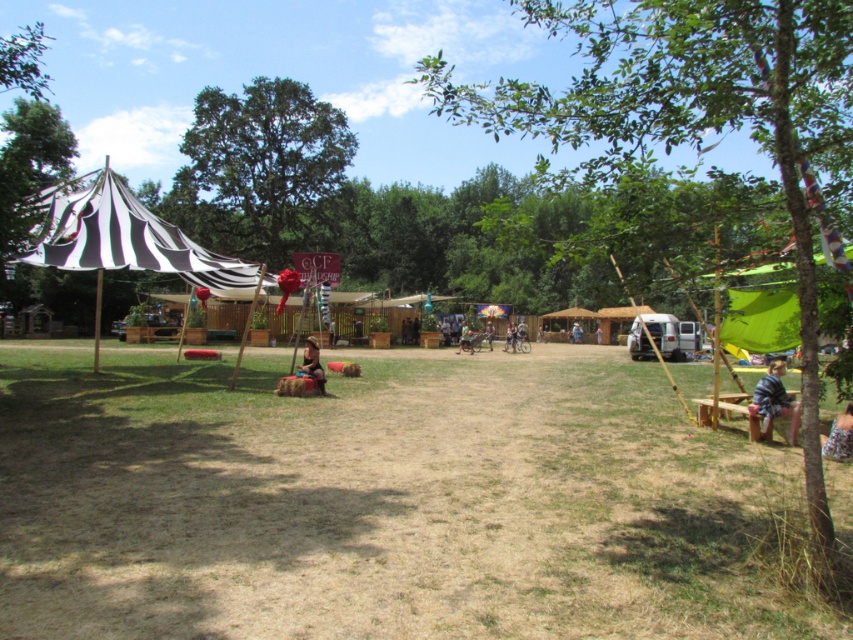
Does brown fabric cushion at center appear under leather jacket at center?

Indeed, brown fabric cushion at center is positioned under leather jacket at center.

Looking at this image, who is lower down, brown fabric cushion at center or leather jacket at center?

Positioned lower is brown fabric cushion at center.

Find the location of `brown fabric cushion at center`. brown fabric cushion at center is located at coordinates [305, 372].

Does green leafy tree at upper left appear under blue striped shirt at lower right?

Actually, green leafy tree at upper left is above blue striped shirt at lower right.

Which is behind, point (28, 74) or point (788, 413)?

Point (28, 74)

Where is `green leafy tree at upper left`? The width and height of the screenshot is (853, 640). green leafy tree at upper left is located at coordinates (22, 61).

Who is more distant from viewer, (790, 419) or (828, 444)?

Positioned behind is point (790, 419).

Between blue striped shirt at lower right and denim shorts at lower right, which one is positioned lower?

denim shorts at lower right

Between point (782, 364) and point (831, 456), which one is positioned behind?

Point (782, 364)

I want to click on blue striped shirt at lower right, so click(775, 401).